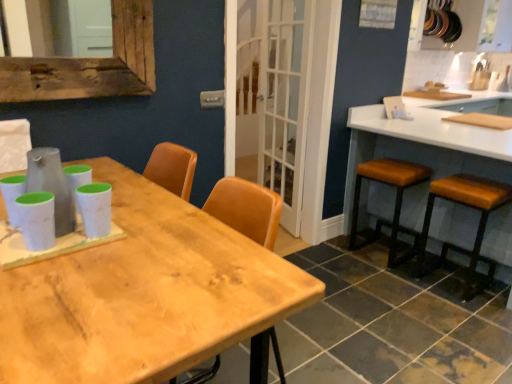
Question: Is wooden table at center far from white glossy countertop at right?

Choices:
 (A) no
 (B) yes

Answer: (B)

Question: From the image's perspective, is wooden table at center below white glossy countertop at right?

Choices:
 (A) yes
 (B) no

Answer: (A)

Question: From a real-world perspective, does wooden table at center stand above white glossy countertop at right?

Choices:
 (A) yes
 (B) no

Answer: (A)

Question: From the image's perspective, is wooden table at center on white glossy countertop at right?

Choices:
 (A) no
 (B) yes

Answer: (A)

Question: Are wooden table at center and white glossy countertop at right beside each other?

Choices:
 (A) yes
 (B) no

Answer: (B)

Question: Relative to brown leather stool at right, which is the 2th stool in right-to-left order, is brown leather stool at right, positioned as the 1th stool in right-to-left order, in front or behind?

Choices:
 (A) front
 (B) behind

Answer: (A)

Question: Is brown leather stool at right, the second stool viewed from the left, bigger or smaller than brown leather stool at right, which is counted as the 1th stool, starting from the left?

Choices:
 (A) big
 (B) small

Answer: (B)

Question: Is brown leather stool at right, the second stool viewed from the left, inside the boundaries of brown leather stool at right, which is the 2th stool in right-to-left order, or outside?

Choices:
 (A) inside
 (B) outside

Answer: (B)

Question: From their relative heights in the image, would you say brown leather stool at right, the second stool viewed from the left, is taller or shorter than brown leather stool at right, which is counted as the 1th stool, starting from the left?

Choices:
 (A) tall
 (B) short

Answer: (B)

Question: In terms of size, does wooden table at center appear bigger or smaller than white glass screen door at center?

Choices:
 (A) small
 (B) big

Answer: (B)

Question: From a real-world perspective, is wooden table at center above or below white glass screen door at center?

Choices:
 (A) above
 (B) below

Answer: (B)

Question: Would you say wooden table at center is to the left or to the right of white glass screen door at center in the picture?

Choices:
 (A) left
 (B) right

Answer: (A)

Question: Is wooden table at center taller or shorter than white glass screen door at center?

Choices:
 (A) tall
 (B) short

Answer: (B)

Question: Considering the positions of point (373, 173) and point (261, 114), is point (373, 173) closer or farther from the camera than point (261, 114)?

Choices:
 (A) closer
 (B) farther

Answer: (A)

Question: Would you say brown leather stool at right, which is counted as the 1th stool, starting from the left, is inside or outside white glass screen door at center?

Choices:
 (A) inside
 (B) outside

Answer: (B)